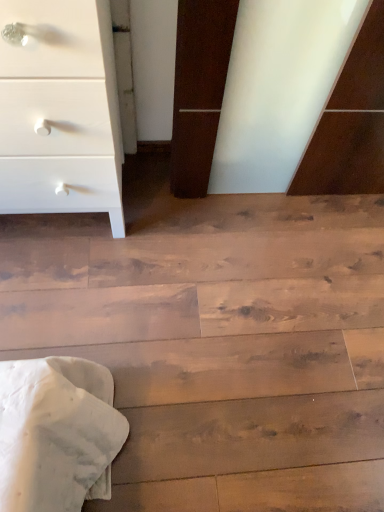
What are the coordinates of `vacant space in front of white matte chest of drawers at upper left` in the screenshot? It's located at (74, 305).